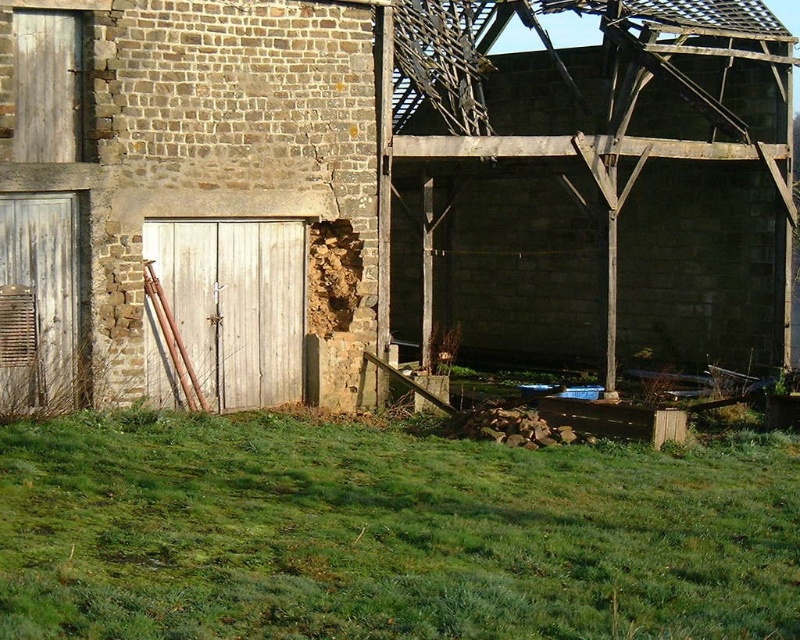
Who is lower down, rustic wooden barn at center or green grass at lower center?

green grass at lower center is lower down.

Is rustic wooden barn at center to the left of green grass at lower center from the viewer's perspective?

Indeed, rustic wooden barn at center is positioned on the left side of green grass at lower center.

Between point (108, 113) and point (580, 465), which one is positioned behind?

The point (108, 113) is behind.

The height and width of the screenshot is (640, 800). Identify the location of rustic wooden barn at center. (384, 193).